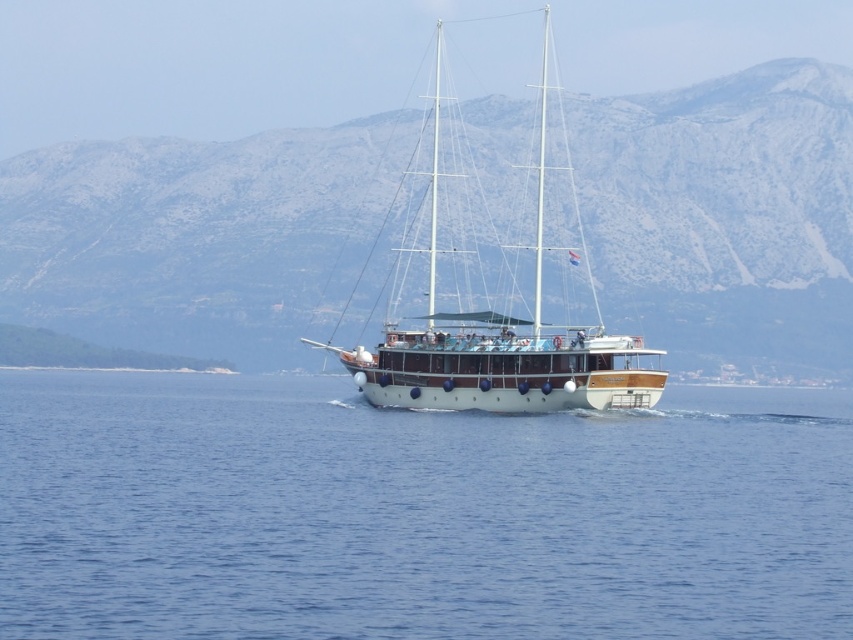
You are a passenger on the white polished wood sailboat at center. You want to know if the blue water at center is higher or lower than the sailboat. Can you determine this based on your current position?

The blue water at center has a lesser height compared to the white polished wood sailboat at center, so the water is lower than the sailboat.

You are standing at the point with coordinates (x=416, y=513). What do you see directly in front of you?

You see blue water at center directly in front of you at point (x=416, y=513).

You are a passenger on the white polished wood sailboat at center. You want to see the blue water at center. Which direction should you look relative to the sailboat?

The blue water at center is in front of the white polished wood sailboat at center, so you should look forward to see the blue water at center.